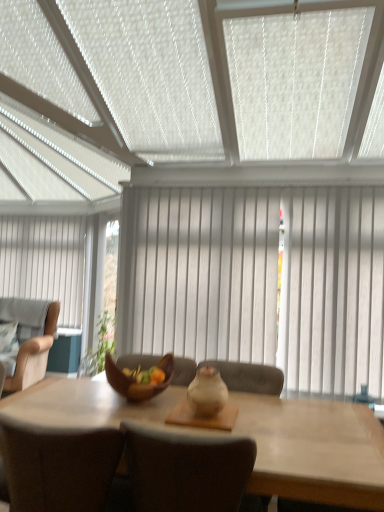
You are a GUI agent. You are given a task and a screenshot of the screen. Output one action in this format:
    pyautogui.click(x=<x>, y=<y>)
    Task: Click on the free space to the left of brown woven bowl at center
    The image size is (384, 512).
    Given the screenshot: What is the action you would take?
    pyautogui.click(x=91, y=396)